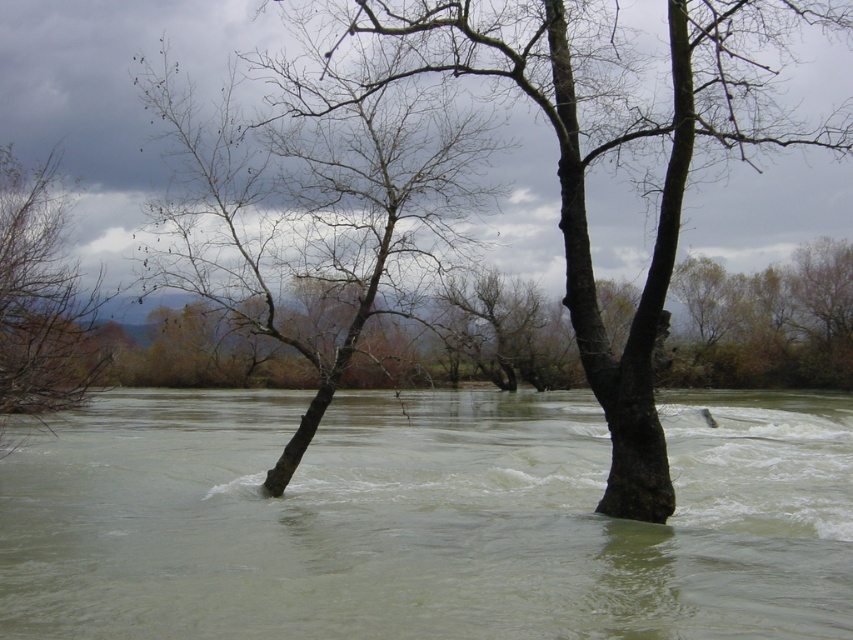
Based on the photo, is brown rough tree at center positioned behind bare wood tree at center?

That is False.

Where is `brown rough tree at center`? brown rough tree at center is located at coordinates click(x=583, y=141).

What are the coordinates of `brown rough tree at center` in the screenshot? It's located at (583, 141).

Who is more distant from viewer, (566, 266) or (74, 392)?

Point (74, 392)

Can you confirm if brown rough tree at center is positioned above bare branches at left?

Correct, brown rough tree at center is located above bare branches at left.

Which is in front, point (809, 13) or point (64, 193)?

Point (809, 13) is more forward.

In order to click on brown rough tree at center in this screenshot , I will do `click(583, 141)`.

Who is lower down, muddy water at center or bare branches at left?

muddy water at center is below.

Is muddy water at center wider than bare branches at left?

Correct, the width of muddy water at center exceeds that of bare branches at left.

Which is behind, point (680, 561) or point (53, 160)?

The point (53, 160) is behind.

I want to click on muddy water at center, so click(x=424, y=518).